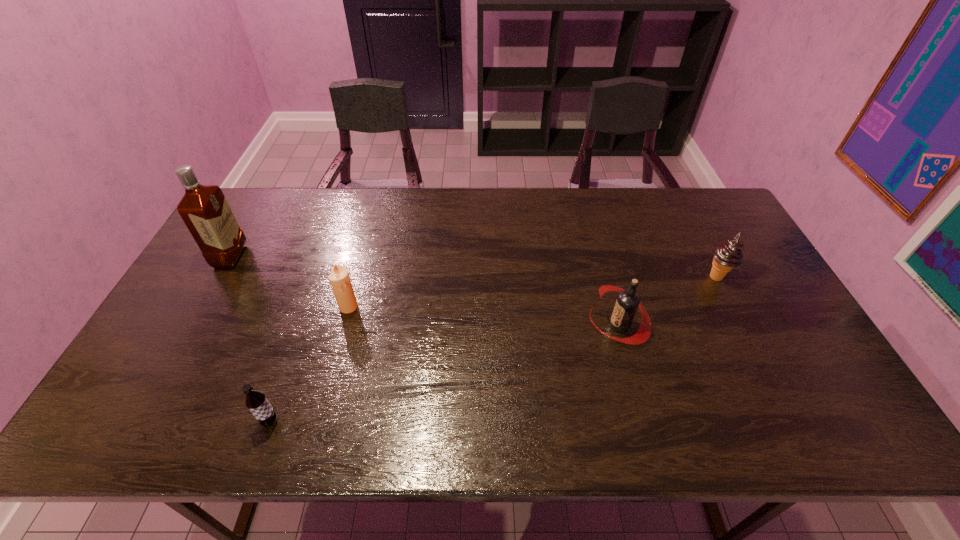
The height and width of the screenshot is (540, 960). I want to click on free space in the image that satisfies the following two spatial constraints: 1. on the front side of the rightmost object; 2. on the label of the farther root beer, so click(741, 325).

The image size is (960, 540). In order to click on vacant point that satisfies the following two spatial constraints: 1. on the front label of the liquor; 2. on the left side of the nearest object in this screenshot , I will do `click(136, 421)`.

Where is `vacant space that satisfies the following two spatial constraints: 1. on the back side of the rightmost object; 2. on the right side of the left root beer`? vacant space that satisfies the following two spatial constraints: 1. on the back side of the rightmost object; 2. on the right side of the left root beer is located at coordinates (321, 277).